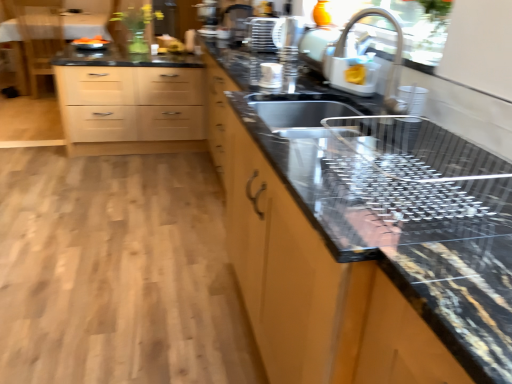
This screenshot has height=384, width=512. Describe the element at coordinates (340, 60) in the screenshot. I see `white plastic dishwashing machine at upper center, the 1th appliance viewed from the right` at that location.

You are a GUI agent. You are given a task and a screenshot of the screen. Output one action in this format:
    pyautogui.click(x=<x>, y=<y>)
    Task: Click on the wooden chair at upper left
    Image resolution: width=512 pixels, height=384 pixels.
    Given the screenshot: What is the action you would take?
    pyautogui.click(x=38, y=35)

The height and width of the screenshot is (384, 512). What do you see at coordinates (274, 33) in the screenshot? I see `metallic grid at upper center, positioned as the 1th appliance in top-to-bottom order` at bounding box center [274, 33].

Identify the location of metallic sink at center. This screenshot has height=384, width=512. (293, 129).

What do you see at coordinates (311, 279) in the screenshot? I see `black granite countertop at center` at bounding box center [311, 279].

Find the location of a particular element. The image size is (512, 384). white plastic dishwashing machine at upper center, which ranks as the 1th appliance in bottom-to-top order is located at coordinates (340, 60).

Considering the relative sizes of black granite countertop at center and black granite table at upper left in the image provided, is black granite countertop at center bigger than black granite table at upper left?

Actually, black granite countertop at center might be smaller than black granite table at upper left.

From a real-world perspective, is black granite countertop at center physically located above or below black granite table at upper left?

From a real-world perspective, black granite countertop at center is physically above black granite table at upper left.

Considering the relative positions of black granite countertop at center and black granite table at upper left in the image provided, is black granite countertop at center to the right of black granite table at upper left from the viewer's perspective?

Correct, you'll find black granite countertop at center to the right of black granite table at upper left.

Is black granite countertop at center further to camera compared to black granite table at upper left?

No, the depth of black granite countertop at center is less than that of black granite table at upper left.

From the image's perspective, is light wood/finish chest of drawers at upper left under black granite table at upper left?

Correct, light wood/finish chest of drawers at upper left appears lower than black granite table at upper left in the image.

Can you confirm if light wood/finish chest of drawers at upper left is bigger than black granite table at upper left?

No.

Is light wood/finish chest of drawers at upper left outside of black granite table at upper left?

Yes.

Is black granite table at upper left placed right next to metallic sink at center?

No, black granite table at upper left is not next to metallic sink at center.

Can you confirm if black granite table at upper left is positioned to the right of metallic sink at center?

No.

Could metallic sink at center be considered to be inside black granite table at upper left?

No.

From the image's perspective, between wooden chair at upper left and white plastic dishwashing machine at upper center, the second appliance viewed from the top, who is located below?

white plastic dishwashing machine at upper center, the second appliance viewed from the top.

Visually, is wooden chair at upper left positioned to the left or to the right of white plastic dishwashing machine at upper center, the second appliance when ordered from left to right?

In the image, wooden chair at upper left appears on the left side of white plastic dishwashing machine at upper center, the second appliance when ordered from left to right.

Which is farther from the camera, (44, 26) or (362, 87)?

The point (44, 26) is more distant.

Is wooden chair at upper left turned away from white plastic dishwashing machine at upper center, the first appliance from the front?

No, wooden chair at upper left is not facing away from white plastic dishwashing machine at upper center, the first appliance from the front.

From a real-world perspective, which is physically below, black granite table at upper left or black granite countertop at center?

black granite table at upper left.

Considering the sizes of objects black granite table at upper left and black granite countertop at center in the image provided, who is smaller, black granite table at upper left or black granite countertop at center?

black granite countertop at center is smaller.

Is black granite table at upper left oriented towards black granite countertop at center?

Yes, black granite table at upper left faces towards black granite countertop at center.

Looking at this image, what's the angular difference between black granite table at upper left and black granite countertop at center's facing directions?

90 degrees separate the facing orientations of black granite table at upper left and black granite countertop at center.

Is black granite countertop at center bigger than metallic grid at upper center, arranged as the 1th appliance when viewed from the back?

Yes, black granite countertop at center is bigger than metallic grid at upper center, arranged as the 1th appliance when viewed from the back.

Which of these two, black granite countertop at center or metallic grid at upper center, the second appliance ordered from the bottom, is wider?

black granite countertop at center is wider.

Could you tell me if black granite countertop at center is turned towards metallic grid at upper center, positioned as the 2th appliance in right-to-left order?

No, black granite countertop at center does not turn towards metallic grid at upper center, positioned as the 2th appliance in right-to-left order.

Between black granite countertop at center and metallic grid at upper center, arranged as the 1th appliance when viewed from the back, which one appears on the right side from the viewer's perspective?

From the viewer's perspective, black granite countertop at center appears more on the right side.

From the image's perspective, which is above, metallic sink at center or white plastic dishwashing machine at upper center, which ranks as the 1th appliance in bottom-to-top order?

white plastic dishwashing machine at upper center, which ranks as the 1th appliance in bottom-to-top order, appears higher in the image.

Could you tell me if metallic sink at center is facing white plastic dishwashing machine at upper center, the 1th appliance viewed from the right?

No, metallic sink at center is not aimed at white plastic dishwashing machine at upper center, the 1th appliance viewed from the right.

At what (x,y) coordinates should I click in order to perform the action: click on sink below the white plastic dishwashing machine at upper center, the second appliance viewed from the top (from the image's perspective). Please return your answer as a coordinate pair (x, y). Looking at the image, I should click on (293, 129).

From a real-world perspective, is metallic sink at center located higher than white plastic dishwashing machine at upper center, which is the second appliance from back to front?

No, from a real-world perspective, metallic sink at center is not above white plastic dishwashing machine at upper center, which is the second appliance from back to front.

At what (x,y) coordinates should I click in order to perform the action: click on table that is on the left side of black granite countertop at center. Please return your answer as a coordinate pair (x, y). The width and height of the screenshot is (512, 384). Looking at the image, I should click on (46, 39).

Find the location of `the chest of drawers in front of the black granite table at upper left`. the chest of drawers in front of the black granite table at upper left is located at coordinates (131, 109).

Considering their positions, is black granite table at upper left positioned further to wooden chair at upper left than metallic grid at upper center, positioned as the 1th appliance in top-to-bottom order?

metallic grid at upper center, positioned as the 1th appliance in top-to-bottom order, lies further to wooden chair at upper left than the other object.

When comparing their distances from wooden chair at upper left, does light wood/finish chest of drawers at upper left or metallic sink at center seem closer?

light wood/finish chest of drawers at upper left is closer to wooden chair at upper left.

Considering their positions, is light wood/finish chest of drawers at upper left positioned closer to metallic grid at upper center, positioned as the 2th appliance in right-to-left order, than wooden chair at upper left?

light wood/finish chest of drawers at upper left.

Considering their positions, is wooden chair at upper left positioned further to white plastic dishwashing machine at upper center, the 1th appliance viewed from the right, than light wood/finish chest of drawers at upper left?

wooden chair at upper left.

Considering their positions, is metallic grid at upper center, positioned as the 2th appliance in right-to-left order, positioned further to wooden chair at upper left than metallic sink at center?

metallic sink at center is positioned further to the anchor wooden chair at upper left.

Looking at the image, which one is located closer to black granite table at upper left, black granite countertop at center or metallic sink at center?

The object closer to black granite table at upper left is black granite countertop at center.

From the image, which object appears to be nearer to black granite countertop at center, light wood/finish chest of drawers at upper left or wooden chair at upper left?

light wood/finish chest of drawers at upper left lies closer to black granite countertop at center than the other object.

When comparing their distances from black granite table at upper left, does white plastic dishwashing machine at upper center, the 1th appliance viewed from the right, or wooden chair at upper left seem further?

white plastic dishwashing machine at upper center, the 1th appliance viewed from the right, is positioned further to the anchor black granite table at upper left.

This screenshot has height=384, width=512. Identify the location of sink between black granite countertop at center and light wood/finish chest of drawers at upper left in the front-back direction. (293, 129).

The height and width of the screenshot is (384, 512). I want to click on appliance between black granite countertop at center and metallic grid at upper center, which appears as the second appliance when viewed from the front, from front to back, so click(340, 60).

The image size is (512, 384). In order to click on the chest of drawers located between wooden chair at upper left and white plastic dishwashing machine at upper center, the second appliance viewed from the top, in the left-right direction in this screenshot , I will do `click(131, 109)`.

The width and height of the screenshot is (512, 384). Identify the location of chair between light wood/finish chest of drawers at upper left and black granite table at upper left from front to back. pos(38,35).